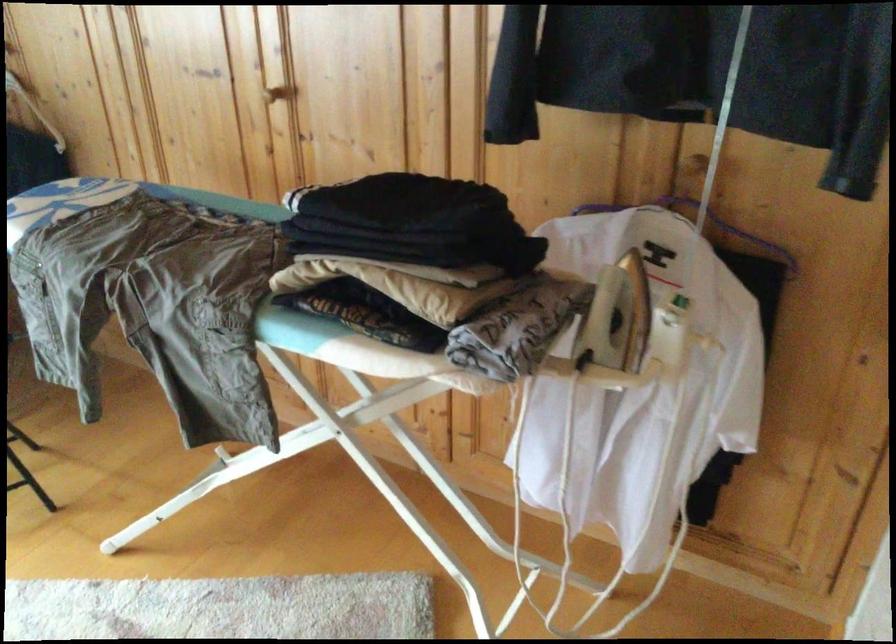
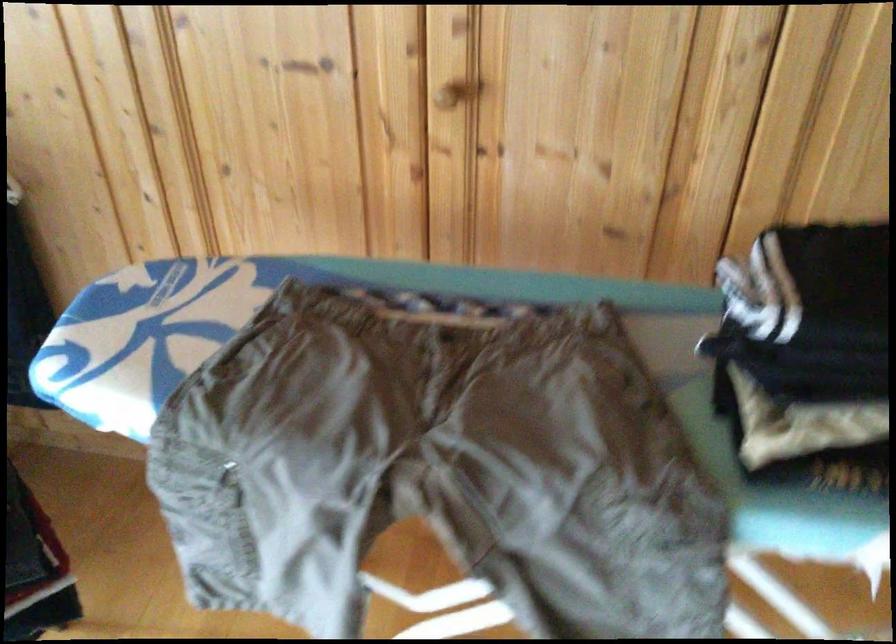
Question: The camera is either moving clockwise (left) or counter-clockwise (right) around the object. The first image is from the beginning of the video and the second image is from the end. Is the camera moving left or right when shooting the video?

Choices:
 (A) Left
 (B) Right

Answer: (A)